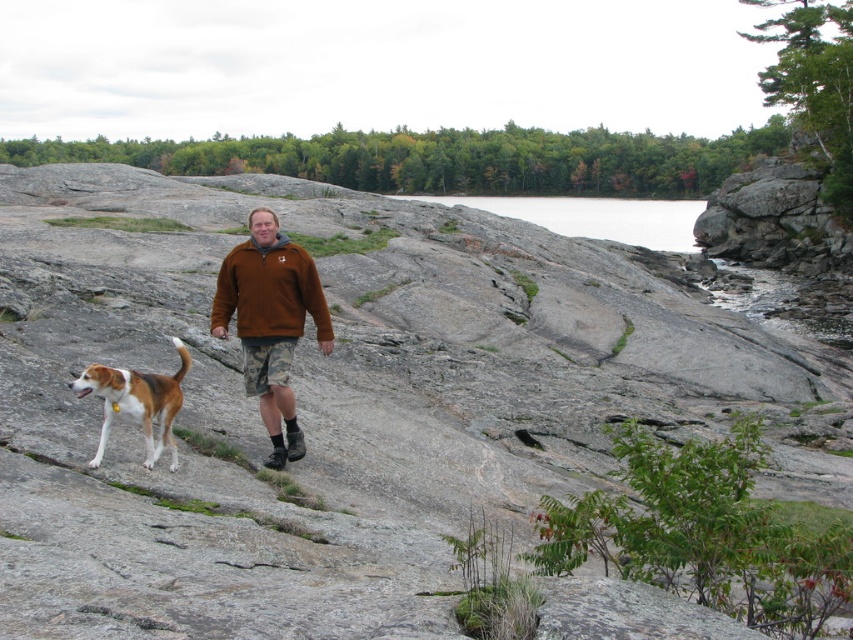
You are a hiker trying to determine if your backpack can fit in the space where the brown fleece jacket at center is located. The backpack takes up the same amount of space as the transparent water at upper center. Will the backpack fit in that space?

The brown fleece jacket at center occupies less space than the transparent water at upper center. Since the backpack takes up the same space as the transparent water at upper center, it will not fit in the space occupied by the brown fleece jacket at center because the jacket takes up less space.